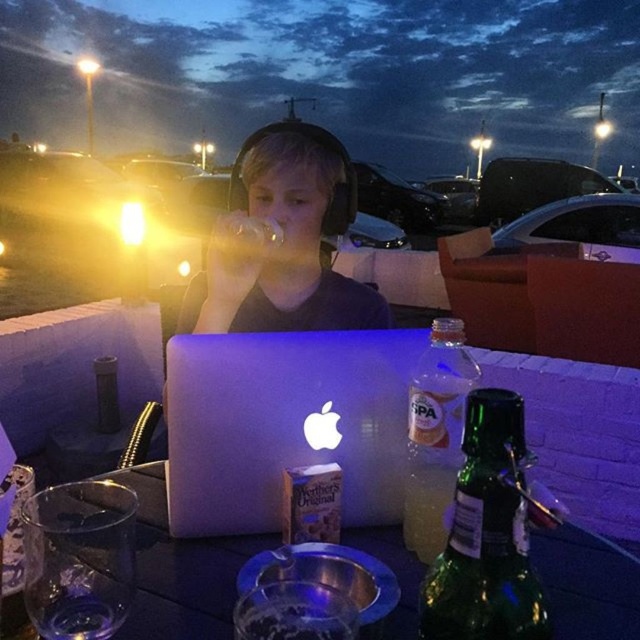
You have a small toy car that is 10 cm long. You want to place it on the shiny black table at center so that it doesn t fall off the edge. Considering the green glass bottle at lower right is already on the table, where should you place the toy car to ensure it stays on the table?

The shiny black table at center might be wider than green glass bottle at lower right, so placing the toy car away from the edge near the green glass bottle at lower right would help keep it on the table.

You are a delivery person trying to place a small package on the shiny black table at center. However, there is a clear plastic bottle at right on the table. Where should you move the bottle to make space for the package?

You should move the clear plastic bottle at right to the back of the shiny black table at center since the table is in front of the bottle, creating space in front for the package.

You are a delivery person who needs to place a small package on the table. The package is 8 inches long. Can you fit it between the shiny black table at center and the clear plastic bottle at right without moving the bottle?

The shiny black table at center is 7.25 inches from the clear plastic bottle at right. Since the package is 8 inches long, which is longer than the available space between them, it won